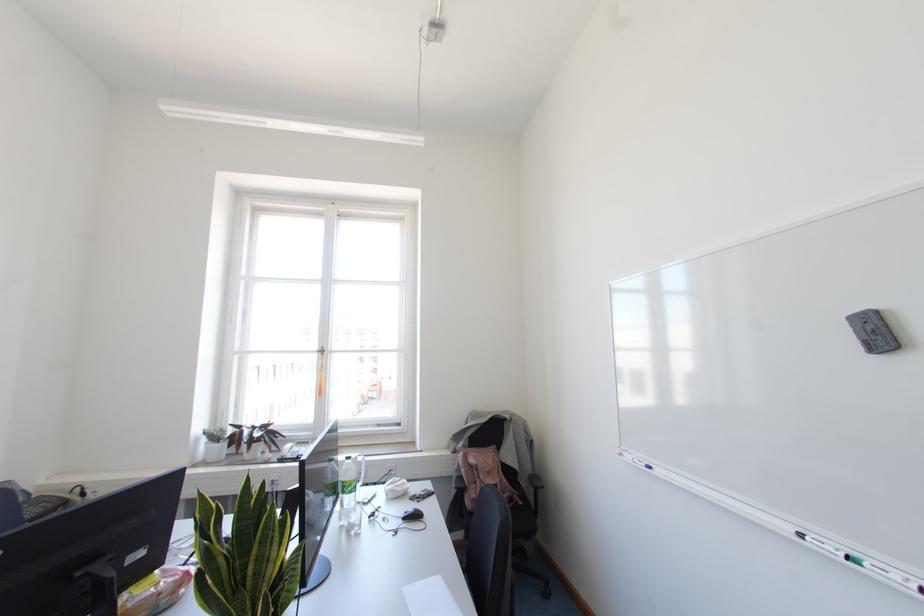
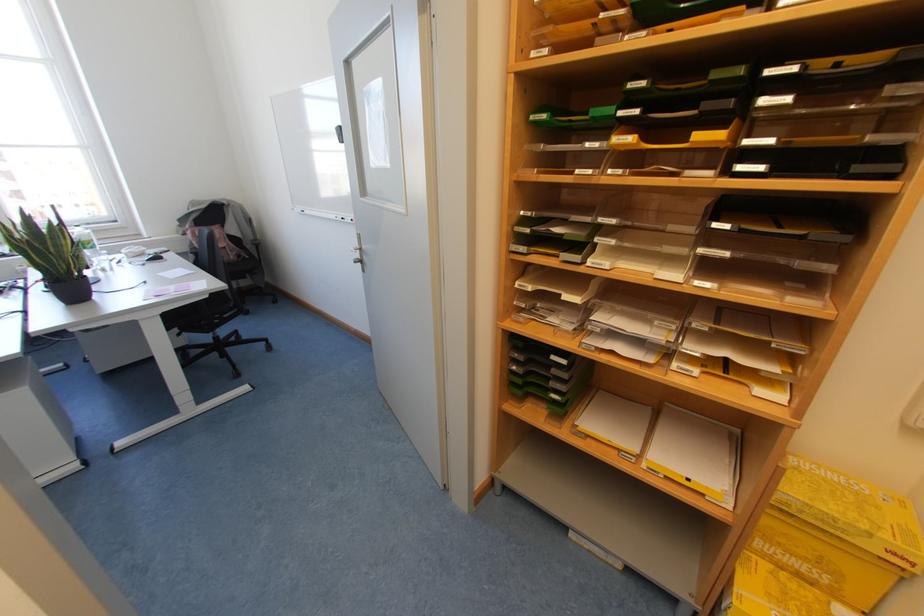
In the second image, find the point that corresponds to [256,559] in the first image.

(53, 245)